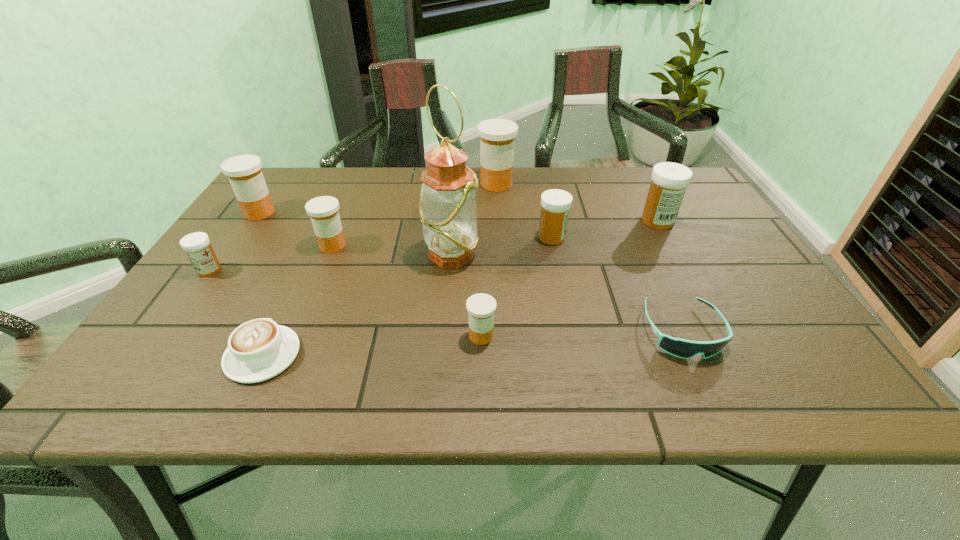
Where is `free space located 0.190m on the label of the ninth shortest object`? free space located 0.190m on the label of the ninth shortest object is located at coordinates (415, 184).

Find the location of a particular element. The width and height of the screenshot is (960, 540). vacant space located on the label of the leftmost orange medicine is located at coordinates (371, 213).

I want to click on vacant region located 0.150m on the back of the biggest white medicine, so click(x=638, y=185).

You are a GUI agent. You are given a task and a screenshot of the screen. Output one action in this format:
    pyautogui.click(x=<x>, y=<y>)
    Task: Click on the free region located on the label of the fifth medicine from right to left
    
    Given the screenshot: What is the action you would take?
    pyautogui.click(x=375, y=246)

Find the location of a particular element. The image size is (960, 540). vacant area located 0.230m on the left of the second white medicine from right to left is located at coordinates (447, 238).

Locate an element on the screen. The image size is (960, 540). free point located on the right of the leftmost white medicine is located at coordinates (353, 270).

The image size is (960, 540). I want to click on vacant space positioned on the label of the smallest orange medicine, so 481,381.

At what (x,y) coordinates should I click in order to perform the action: click on free space located with the handle on the right side of the cappuccino. Please return your answer as a coordinate pair (x, y). The image size is (960, 540). Looking at the image, I should click on (283, 310).

Find the location of `blank space located with the handle on the right side of the cappuccino`. blank space located with the handle on the right side of the cappuccino is located at coordinates (322, 230).

Locate an element on the screen. The height and width of the screenshot is (540, 960). vacant region located with the handle on the right side of the cappuccino is located at coordinates (321, 232).